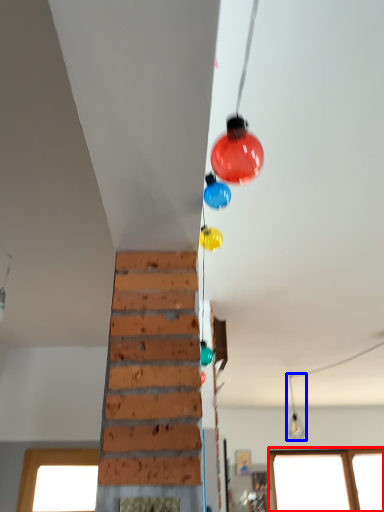
Question: Which object is closer to the camera taking this photo, window (highlighted by a red box) or light fixture (highlighted by a blue box)?

Choices:
 (A) window
 (B) light fixture

Answer: (B)